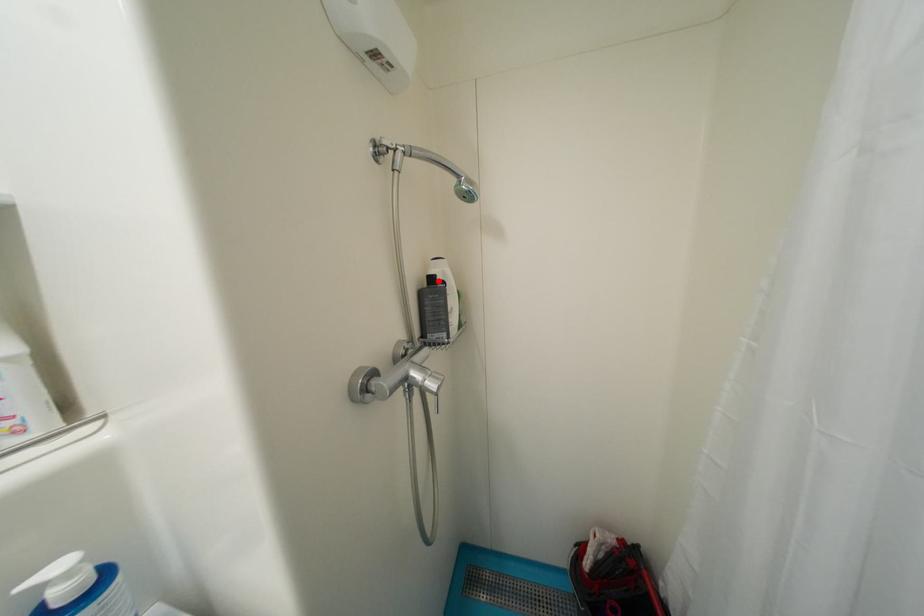
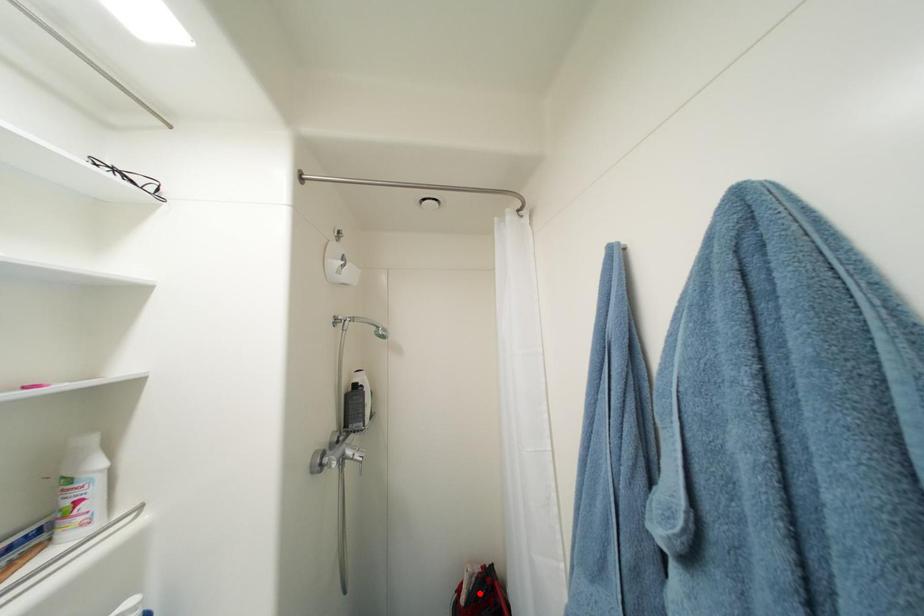
In the scene shown: I am providing you with two images of the same scene from different viewpoints. A red point is marked on the first image and another point is marked on the second image. Is the marked point in image1 the same physical position as the marked point in image2?

No